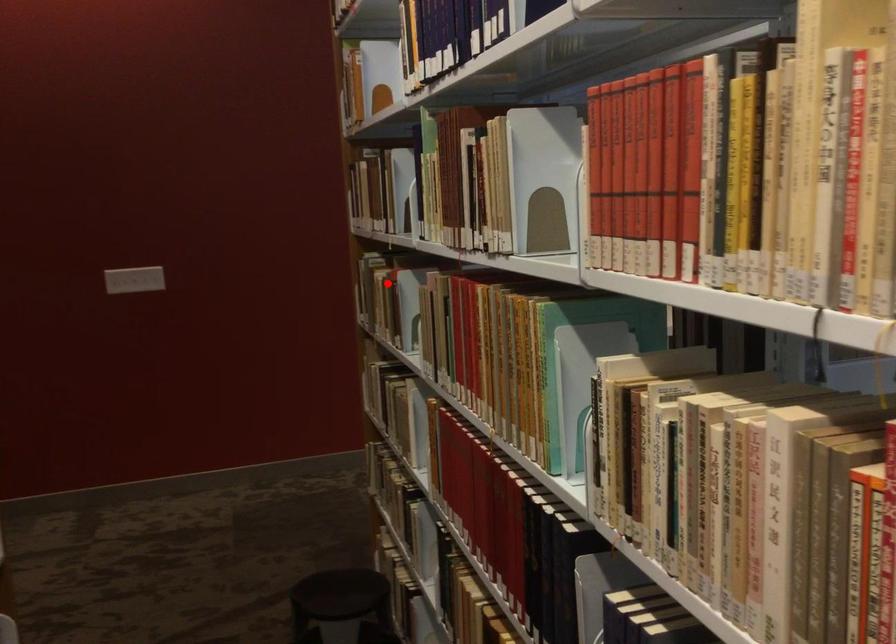
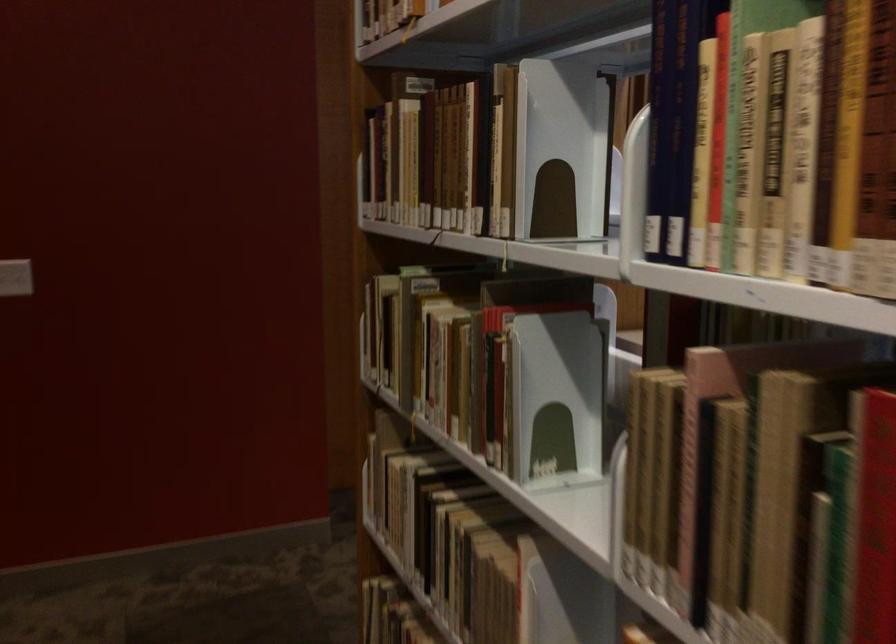
Question: I am providing you with two images of the same scene from different viewpoints. A red point is shown in image1. For the corresponding object point in image2, is it positioned nearer or farther from the camera?

Choices:
 (A) Nearer
 (B) Farther

Answer: (A)